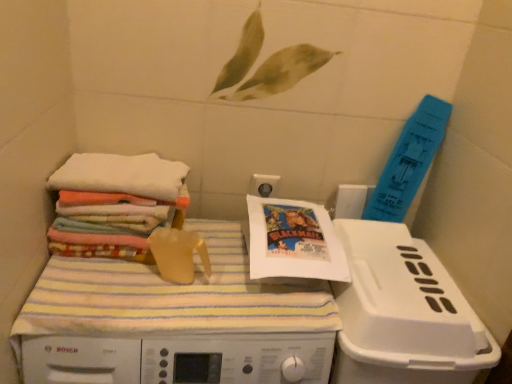
Question: Is there a large distance between white plastic machine at center and multicolored fabric stack at left?

Choices:
 (A) no
 (B) yes

Answer: (A)

Question: Is white plastic machine at center at the left side of multicolored fabric stack at left?

Choices:
 (A) yes
 (B) no

Answer: (B)

Question: Does white plastic machine at center touch multicolored fabric stack at left?

Choices:
 (A) no
 (B) yes

Answer: (A)

Question: From the image's perspective, is white plastic machine at center above multicolored fabric stack at left?

Choices:
 (A) yes
 (B) no

Answer: (B)

Question: Can you confirm if white plastic machine at center is shorter than multicolored fabric stack at left?

Choices:
 (A) yes
 (B) no

Answer: (B)

Question: Does white plastic machine at center have a greater width compared to multicolored fabric stack at left?

Choices:
 (A) no
 (B) yes

Answer: (B)

Question: From a real-world perspective, is white soft towels at left over multicolored fabric stack at left?

Choices:
 (A) yes
 (B) no

Answer: (A)

Question: Considering the relative sizes of white soft towels at left and multicolored fabric stack at left in the image provided, is white soft towels at left thinner than multicolored fabric stack at left?

Choices:
 (A) yes
 (B) no

Answer: (B)

Question: Is multicolored fabric stack at left at the back of white soft towels at left?

Choices:
 (A) yes
 (B) no

Answer: (B)

Question: Does white soft towels at left appear on the left side of multicolored fabric stack at left?

Choices:
 (A) yes
 (B) no

Answer: (B)

Question: Is white soft towels at left closer to the viewer compared to multicolored fabric stack at left?

Choices:
 (A) yes
 (B) no

Answer: (A)

Question: From the image's perspective, is white soft towels at left located above multicolored fabric stack at left?

Choices:
 (A) yes
 (B) no

Answer: (A)

Question: Can you confirm if white paper comic book at center is taller than white soft towels at left?

Choices:
 (A) yes
 (B) no

Answer: (A)